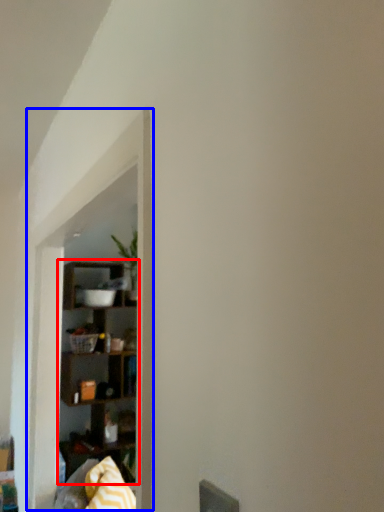
Question: Which of the following is the closest to the observer, shelf (highlighted by a red box) or window sill (highlighted by a blue box)?

Choices:
 (A) shelf
 (B) window sill

Answer: (B)